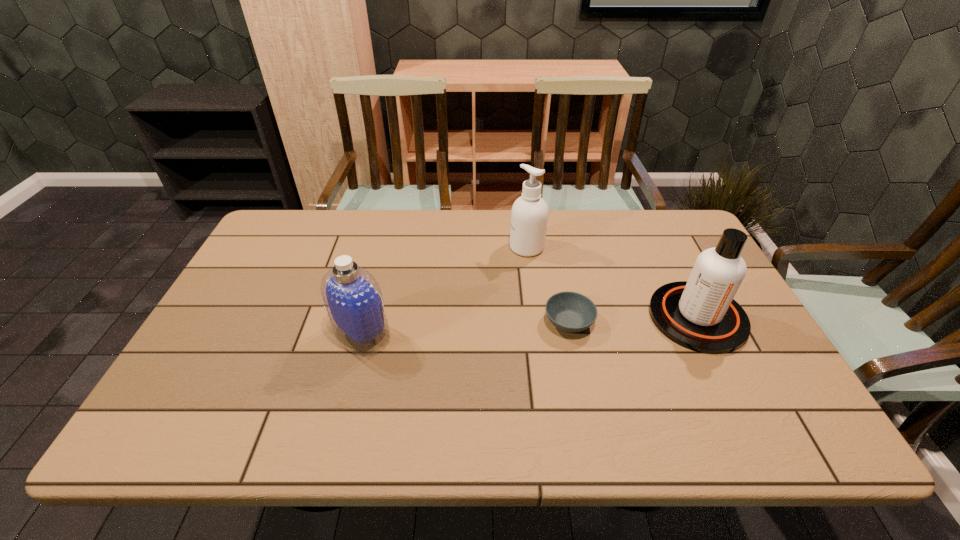
I want to click on free area in between the leftmost cleansing agent and the farthest object, so click(x=444, y=291).

You are a GUI agent. You are given a task and a screenshot of the screen. Output one action in this format:
    pyautogui.click(x=<x>, y=<y>)
    Task: Click on the empty location between the leftmost object and the rightmost object
    This screenshot has height=540, width=960.
    Given the screenshot: What is the action you would take?
    pyautogui.click(x=530, y=326)

Find the location of a particular element. The image size is (960, 540). vacant point located between the leftmost object and the farthest cleansing agent is located at coordinates (444, 291).

You are a GUI agent. You are given a task and a screenshot of the screen. Output one action in this format:
    pyautogui.click(x=<x>, y=<y>)
    Task: Click on the free spot between the shortest object and the rightmost object
    This screenshot has height=540, width=960.
    Given the screenshot: What is the action you would take?
    pyautogui.click(x=633, y=320)

Find the location of a particular element. Image resolution: width=960 pixels, height=540 pixels. vacant region between the farthest object and the rightmost cleansing agent is located at coordinates click(612, 282).

Find the location of a particular element. This screenshot has height=540, width=960. free space between the rightmost cleansing agent and the leftmost cleansing agent is located at coordinates (530, 326).

Find the location of `free space between the farthest cleansing agent and the soup bowl`. free space between the farthest cleansing agent and the soup bowl is located at coordinates (548, 285).

Point out which object is positioned as the third nearest to the soup bowl. Please provide its 2D coordinates. Your answer should be formatted as a tuple, i.e. [(x, y)], where the tuple contains the x and y coordinates of a point satisfying the conditions above.

[(353, 299)]

The height and width of the screenshot is (540, 960). Identify the location of the second closest object to the leftmost object. tap(529, 215).

Where is `cleansing agent object that ranks as the closest to the leftmost cleansing agent`? This screenshot has width=960, height=540. cleansing agent object that ranks as the closest to the leftmost cleansing agent is located at coordinates (529, 215).